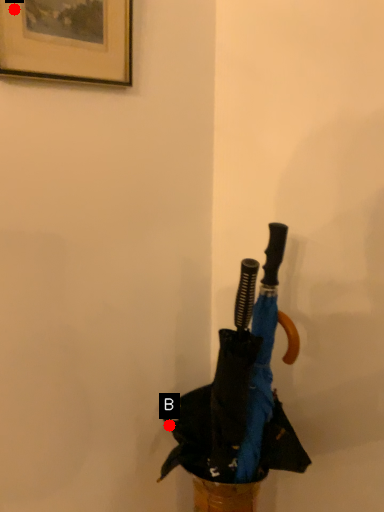
Question: Two points are circled on the image, labeled by A and B beside each circle. Which point is farther from the camera taking this photo?

Choices:
 (A) A is further
 (B) B is further

Answer: (B)